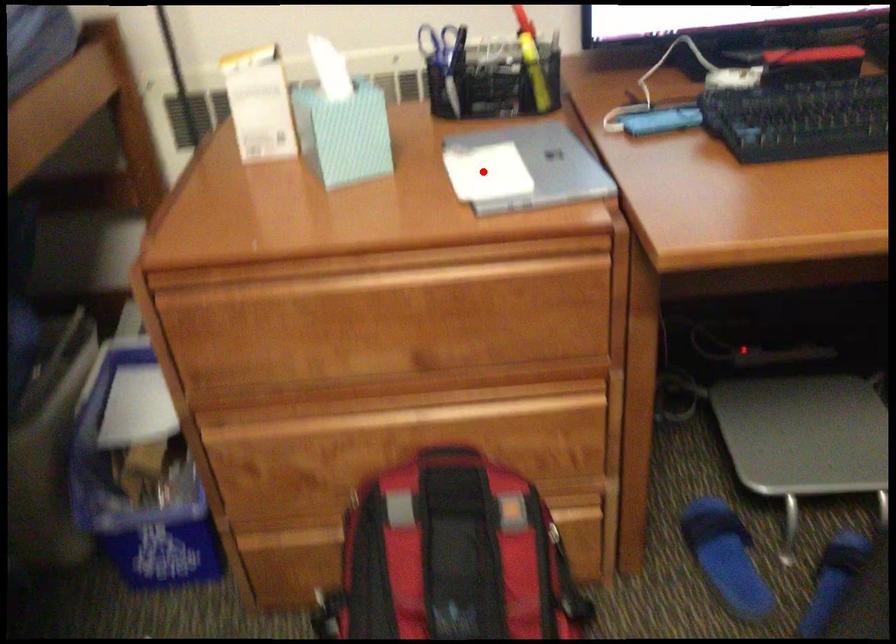
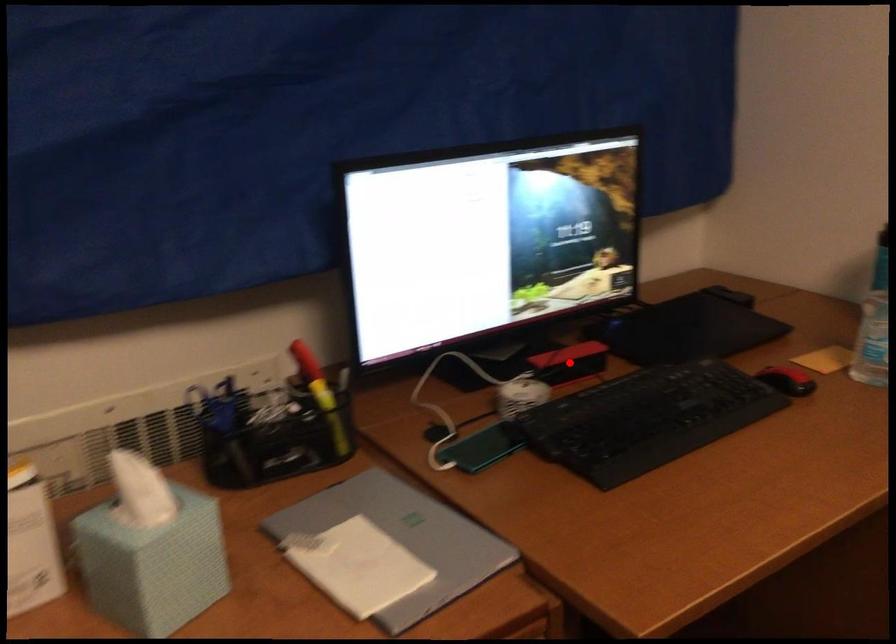
Consider the image. I am providing you with two images of the same scene from different viewpoints. A red point is marked on the first image and another point is marked on the second image. Is the red point in image1 aligned with the point shown in image2?

No